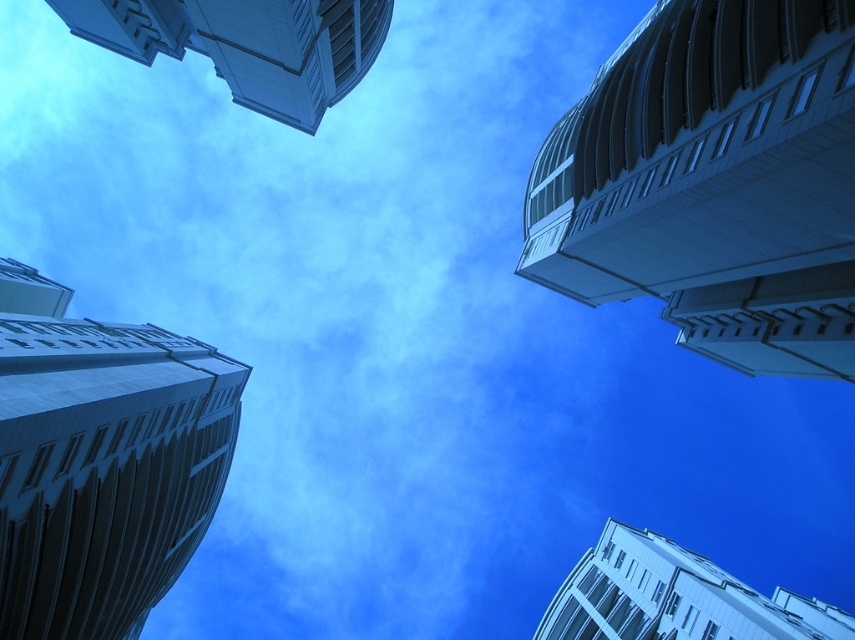
Question: Is smooth white building at left to the right of white glossy building at upper left from the viewer's perspective?

Choices:
 (A) no
 (B) yes

Answer: (A)

Question: Observing the image, what is the correct spatial positioning of white smooth building at upper right in reference to smooth white building at left?

Choices:
 (A) above
 (B) below

Answer: (A)

Question: Which object is the farthest from the white glossy building at upper left?

Choices:
 (A) white smooth building at upper right
 (B) smooth white building at left
 (C) white glossy building at upper right

Answer: (C)

Question: Where is white smooth building at upper right located in relation to white glossy building at upper right in the image?

Choices:
 (A) below
 (B) above

Answer: (B)

Question: Which point is closer to the camera?

Choices:
 (A) (9, 388)
 (B) (581, 592)
 (C) (102, 35)

Answer: (A)

Question: Which of the following is the farthest from the observer?

Choices:
 (A) smooth white building at left
 (B) white smooth building at upper right
 (C) white glossy building at upper left

Answer: (C)